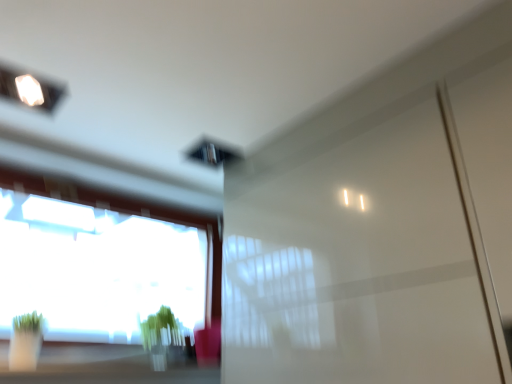
What do you see at coordinates (361, 260) in the screenshot? I see `glossy white screen door at center` at bounding box center [361, 260].

This screenshot has height=384, width=512. In order to click on green matte plant at lower center in this screenshot , I will do `click(160, 328)`.

Measure the distance between green matte plant at lower center and camera.

green matte plant at lower center is 5.61 feet away from camera.

Identify the location of transparent glass window at lower left. This screenshot has width=512, height=384. (113, 259).

From the image's perspective, does green matte plant at lower center appear higher than glossy white screen door at center?

Incorrect, from the image's perspective, green matte plant at lower center is lower than glossy white screen door at center.

Which object is positioned more to the left, green matte plant at lower center or glossy white screen door at center?

Positioned to the left is green matte plant at lower center.

Is green matte plant at lower center further to the viewer compared to glossy white screen door at center?

Yes, it is behind glossy white screen door at center.

From their relative heights in the image, would you say green matte plant at lower center is taller or shorter than transparent glass window at lower left?

In the image, green matte plant at lower center appears to be shorter than transparent glass window at lower left.

Which is more to the right, green matte plant at lower center or transparent glass window at lower left?

green matte plant at lower center is more to the right.

You are a GUI agent. You are given a task and a screenshot of the screen. Output one action in this format:
    pyautogui.click(x=<x>, y=<y>)
    Task: Click on the window above the green matte plant at lower center (from the image's perspective)
    Image resolution: width=512 pixels, height=384 pixels.
    Given the screenshot: What is the action you would take?
    pyautogui.click(x=113, y=259)

Considering the points (168, 330) and (203, 231), which point is in front, point (168, 330) or point (203, 231)?

Positioned in front is point (168, 330).

Considering the relative positions of glossy white screen door at center and green matte plant at lower center in the image provided, is glossy white screen door at center to the left of green matte plant at lower center from the viewer's perspective?

In fact, glossy white screen door at center is to the right of green matte plant at lower center.

Based on the photo, is glossy white screen door at center turned away from green matte plant at lower center?

glossy white screen door at center is not turned away from green matte plant at lower center.

Which object is further away from the camera taking this photo, glossy white screen door at center or green matte plant at lower center?

Positioned behind is green matte plant at lower center.

In the scene shown: Is glossy white screen door at center wider or thinner than green matte plant at lower center?

glossy white screen door at center is wider than green matte plant at lower center.

Does point (208, 294) appear closer or farther from the camera than point (302, 233)?

Clearly, point (208, 294) is more distant from the camera than point (302, 233).

Between transparent glass window at lower left and glossy white screen door at center, which one appears on the right side from the viewer's perspective?

From the viewer's perspective, glossy white screen door at center appears more on the right side.

Which of these two, transparent glass window at lower left or glossy white screen door at center, is thinner?

Thinner between the two is transparent glass window at lower left.

Does transparent glass window at lower left have a smaller size compared to glossy white screen door at center?

Yes.

From a real-world perspective, is glossy white screen door at center beneath transparent glass window at lower left?

Yes, from a real-world perspective, glossy white screen door at center is below transparent glass window at lower left.

Which object is wider, glossy white screen door at center or transparent glass window at lower left?

With larger width is glossy white screen door at center.

Is point (358, 381) less distant than point (218, 293)?

Yes, point (358, 381) is closer to viewer.

Which object is more forward, transparent glass window at lower left or green matte plant at lower center?

transparent glass window at lower left is more forward.

Is transparent glass window at lower left spatially inside green matte plant at lower center, or outside of it?

transparent glass window at lower left is not inside green matte plant at lower center, it's outside.

Who is shorter, transparent glass window at lower left or green matte plant at lower center?

With less height is green matte plant at lower center.

From the image's perspective, is transparent glass window at lower left located beneath green matte plant at lower center?

No, from the image's perspective, transparent glass window at lower left is not beneath green matte plant at lower center.

Find the location of a particular element. The height and width of the screenshot is (384, 512). screen door in front of the green matte plant at lower center is located at coordinates (361, 260).

I want to click on plant that is on the right side of transparent glass window at lower left, so click(x=160, y=328).

Considering their positions, is green matte plant at lower center positioned closer to glossy white screen door at center than transparent glass window at lower left?

green matte plant at lower center is positioned closer to the anchor glossy white screen door at center.

Which object lies nearer to the anchor point glossy white screen door at center, transparent glass window at lower left or green matte plant at lower center?

Among the two, green matte plant at lower center is located nearer to glossy white screen door at center.

Considering their positions, is green matte plant at lower center positioned further to transparent glass window at lower left than glossy white screen door at center?

glossy white screen door at center.

Based on their spatial positions, is transparent glass window at lower left or glossy white screen door at center further from green matte plant at lower center?

glossy white screen door at center.

Which object lies nearer to the anchor point transparent glass window at lower left, glossy white screen door at center or green matte plant at lower center?

Among the two, green matte plant at lower center is located nearer to transparent glass window at lower left.

When comparing their distances from green matte plant at lower center, does glossy white screen door at center or transparent glass window at lower left seem closer?

transparent glass window at lower left.

At what (x,y) coordinates should I click in order to perform the action: click on plant between transparent glass window at lower left and glossy white screen door at center from left to right. Please return your answer as a coordinate pair (x, y). Looking at the image, I should click on (160, 328).